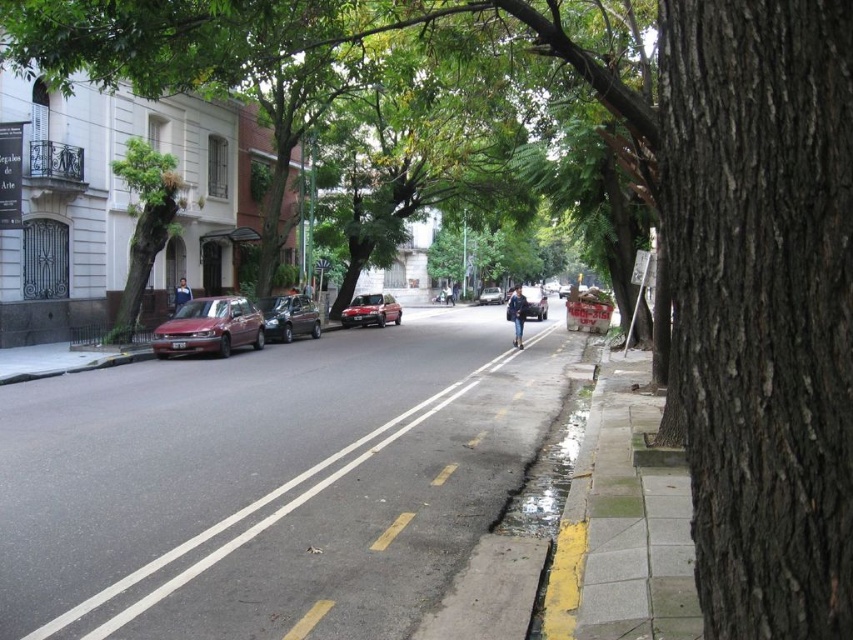
You are a delivery person trying to park your van between the satin dark gray car at center and the shiny red car at center. Can you fit your van, which is 2 meters wide, in the space between them?

The satin dark gray car at center is positioned under the shiny red car at center, so there is no space between them for the van to park.